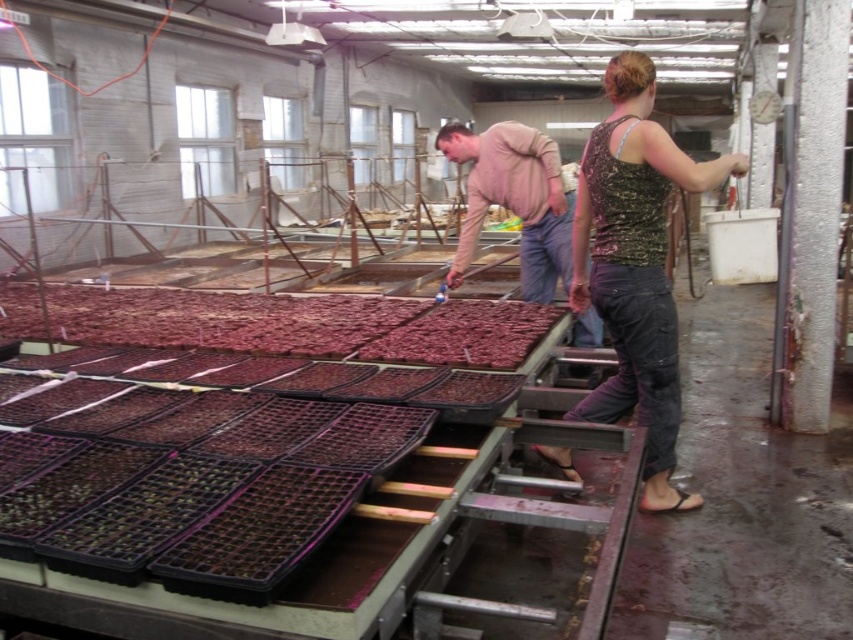
You are a visitor in the greenhouse and want to know if the black plastic trays at lower left can be seen over the camouflage tank top at center. Can you see them from your current position?

The black plastic trays at lower left are not as tall as the camouflage tank top at center, so they would be obscured by the camouflage tank top at center from your current position.